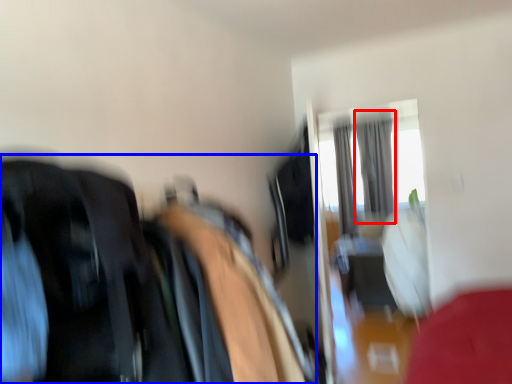
Question: Among these objects, which one is farthest to the camera, curtain (highlighted by a red box) or laundry (highlighted by a blue box)?

Choices:
 (A) curtain
 (B) laundry

Answer: (A)